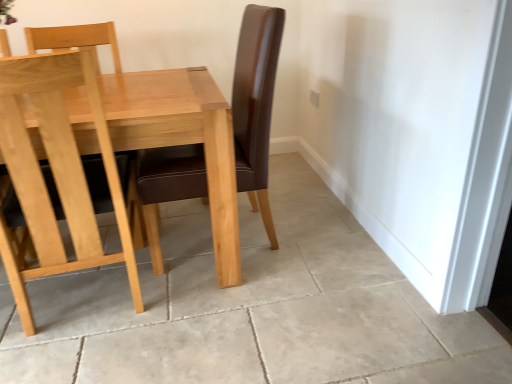
Question: Is natural wood table at center far from light gray tile floor at center?

Choices:
 (A) no
 (B) yes

Answer: (A)

Question: Is natural wood table at center thinner than light gray tile floor at center?

Choices:
 (A) yes
 (B) no

Answer: (A)

Question: Is natural wood table at center to the left of light gray tile floor at center from the viewer's perspective?

Choices:
 (A) yes
 (B) no

Answer: (A)

Question: Is natural wood table at center smaller than light gray tile floor at center?

Choices:
 (A) yes
 (B) no

Answer: (B)

Question: Is natural wood table at center looking in the opposite direction of light gray tile floor at center?

Choices:
 (A) yes
 (B) no

Answer: (B)

Question: Is natural wood table at center with light gray tile floor at center?

Choices:
 (A) yes
 (B) no

Answer: (B)

Question: From the image's perspective, is natural wood table at center over light brown wood chair at left?

Choices:
 (A) no
 (B) yes

Answer: (B)

Question: From the image's perspective, is natural wood table at center beneath light brown wood chair at left?

Choices:
 (A) yes
 (B) no

Answer: (B)

Question: Can you confirm if natural wood table at center is bigger than light brown wood chair at left?

Choices:
 (A) yes
 (B) no

Answer: (A)

Question: Does natural wood table at center have a greater width compared to light brown wood chair at left?

Choices:
 (A) yes
 (B) no

Answer: (A)

Question: Is natural wood table at center positioned in front of light brown wood chair at left?

Choices:
 (A) no
 (B) yes

Answer: (A)

Question: Is light brown wood chair at left at the back of natural wood table at center?

Choices:
 (A) no
 (B) yes

Answer: (B)

Question: From the image's perspective, is light gray tile floor at center over natural wood table at center?

Choices:
 (A) no
 (B) yes

Answer: (A)